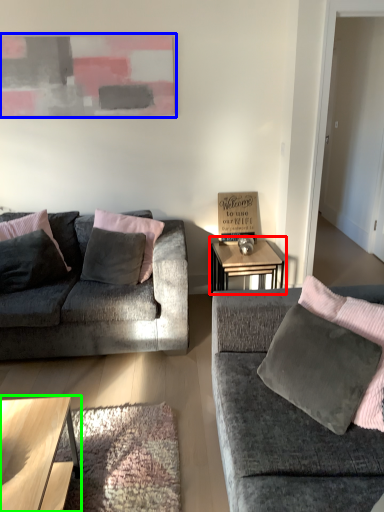
Question: Which object is the farthest from table (highlighted by a red box)? Choose among these: picture frame (highlighted by a blue box) or coffee table (highlighted by a green box).

Choices:
 (A) picture frame
 (B) coffee table

Answer: (B)